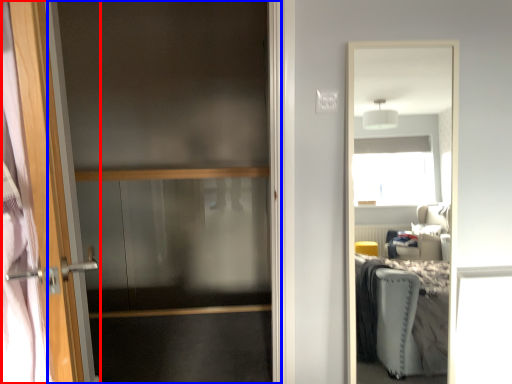
Question: Which object appears farthest to the camera in this image, door (highlighted by a red box) or screen door (highlighted by a blue box)?

Choices:
 (A) door
 (B) screen door

Answer: (B)